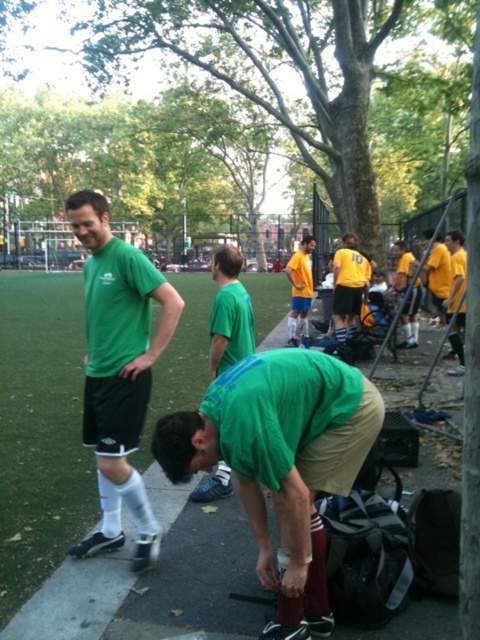
Question: Which of these objects is positioned farthest from the green matte shirt at lower center?

Choices:
 (A) yellow matte shirt at right
 (B) yellow matte shirt at center
 (C) yellow jersey at center

Answer: (B)

Question: Which point appears farthest from the camera in this image?

Choices:
 (A) (464, 323)
 (B) (244, 298)
 (C) (295, 292)
 (D) (338, 284)

Answer: (C)

Question: Does green matte shirt at lower center have a greater width compared to yellow jersey at right?

Choices:
 (A) no
 (B) yes

Answer: (B)

Question: From the image, what is the correct spatial relationship of yellow jersey at center in relation to yellow matte shirt at right?

Choices:
 (A) below
 (B) above

Answer: (A)

Question: Can you confirm if green matte shirt at lower center is positioned below green matte shirt at center?

Choices:
 (A) no
 (B) yes

Answer: (B)

Question: Which object is positioned closest to the yellow matte shirt at right?

Choices:
 (A) green matte shirt at center
 (B) green matte shirt at lower center
 (C) matte green shirt at center
 (D) yellow jersey at right

Answer: (D)